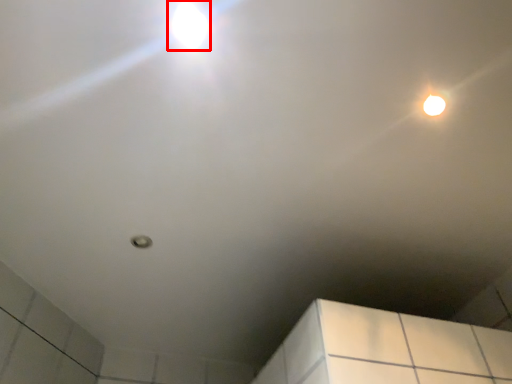
Question: Where is droplight (annotated by the red box) located in relation to droplight in the image?

Choices:
 (A) right
 (B) left

Answer: (B)